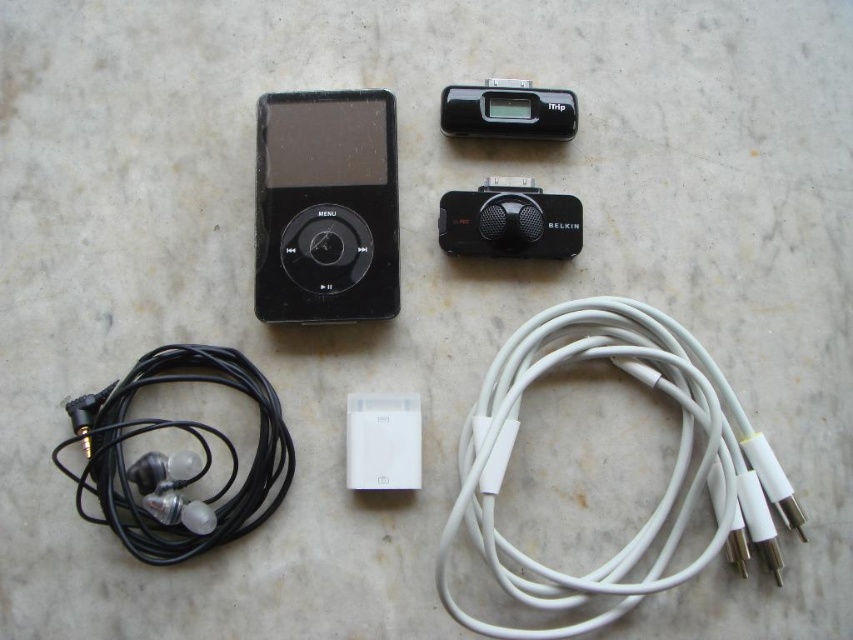
Is point (390, 208) closer to camera compared to point (189, 432)?

No.

Is point (354, 260) farther from camera compared to point (148, 484)?

Yes, it is.

This screenshot has height=640, width=853. In order to click on black matte/ipod at center in this screenshot , I will do `click(326, 205)`.

Between white rubber cable at lower right and black rubber earphones at lower left, which one has less height?

Standing shorter between the two is black rubber earphones at lower left.

Can you confirm if white rubber cable at lower right is taller than black rubber earphones at lower left?

Indeed, white rubber cable at lower right has a greater height compared to black rubber earphones at lower left.

Where is `white rubber cable at lower right`? The height and width of the screenshot is (640, 853). white rubber cable at lower right is located at coordinates (666, 484).

Who is more distant from viewer, (88,460) or (531,97)?

The point (531,97) is more distant.

Is black rubber earphones at lower left to the right of black plastic ipod at upper center from the viewer's perspective?

No, black rubber earphones at lower left is not to the right of black plastic ipod at upper center.

This screenshot has height=640, width=853. What are the coordinates of `black rubber earphones at lower left` in the screenshot? It's located at (177, 458).